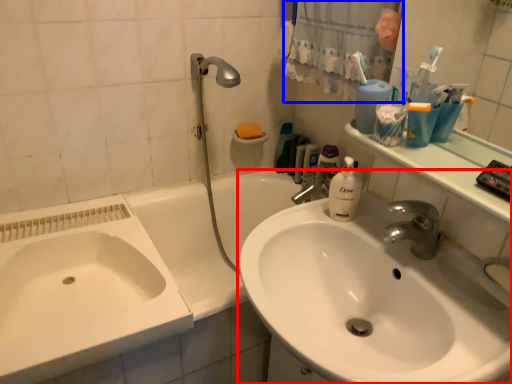
Question: Which object is further to the camera taking this photo, sink (highlighted by a red box) or shower curtain (highlighted by a blue box)?

Choices:
 (A) sink
 (B) shower curtain

Answer: (B)